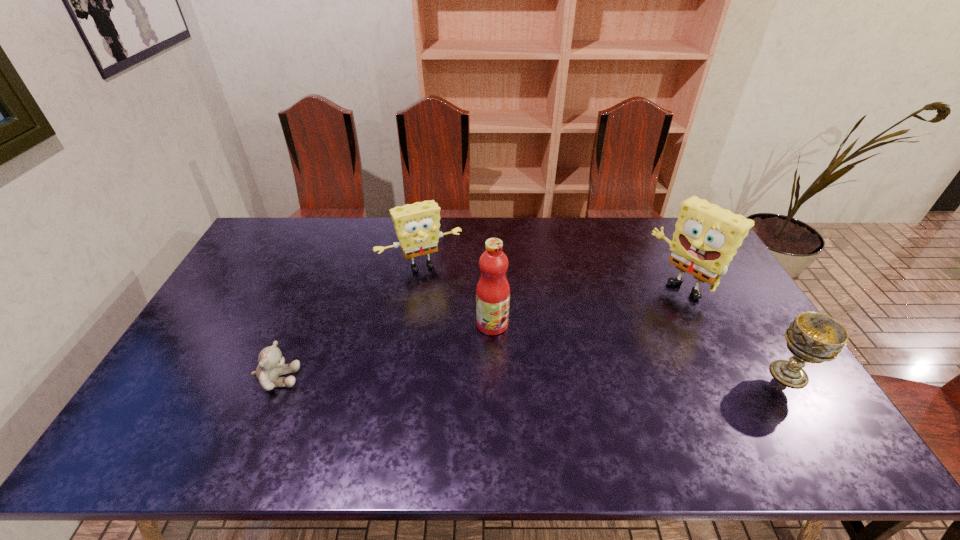
Locate an element on the screen. The height and width of the screenshot is (540, 960). free space that is in between the fruit juice and the taller sponge is located at coordinates (587, 306).

The image size is (960, 540). I want to click on free space between the chalice and the teddy bear, so click(x=533, y=376).

The image size is (960, 540). In order to click on free point between the left sponge and the leftmost object in this screenshot , I will do tap(349, 322).

I want to click on vacant point located between the shorter sponge and the chalice, so click(605, 320).

Locate which object is the fourth closest to the left sponge. Please provide its 2D coordinates. Your answer should be formatted as a tuple, i.e. [(x, y)], where the tuple contains the x and y coordinates of a point satisfying the conditions above.

[(812, 337)]

Identify which object is the second nearest to the leftmost object. Please provide its 2D coordinates. Your answer should be formatted as a tuple, i.e. [(x, y)], where the tuple contains the x and y coordinates of a point satisfying the conditions above.

[(493, 290)]

Find the location of a particular element. vacant area that satisfies the following two spatial constraints: 1. on the front side of the third nearest object; 2. on the left side of the third shortest object is located at coordinates (412, 324).